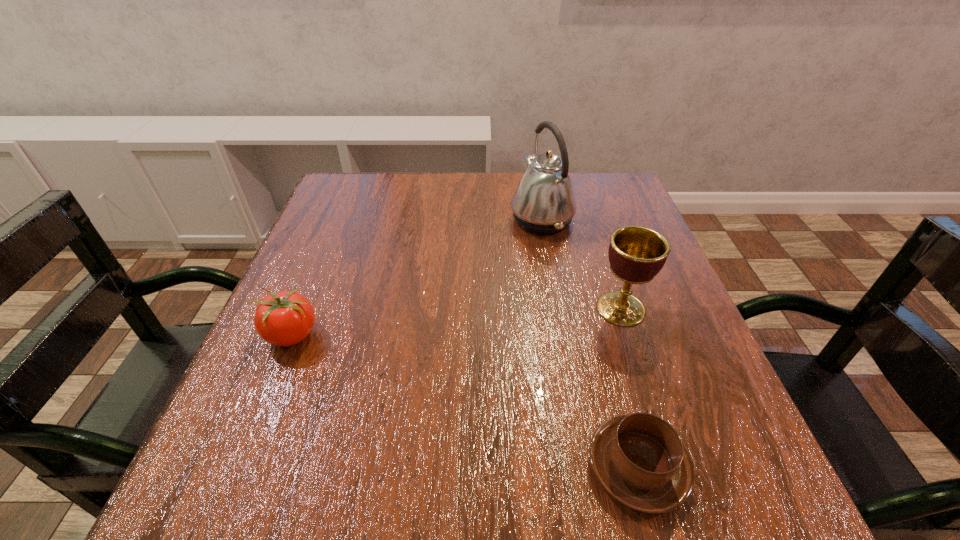
Locate an element on the screen. The width and height of the screenshot is (960, 540). blank area at the near edge is located at coordinates (370, 489).

The width and height of the screenshot is (960, 540). Find the location of `vacant region at the left edge of the desktop`. vacant region at the left edge of the desktop is located at coordinates (340, 241).

Image resolution: width=960 pixels, height=540 pixels. Find the location of `free space at the far left corner`. free space at the far left corner is located at coordinates (366, 174).

The image size is (960, 540). I want to click on blank space at the near left corner of the desktop, so (300, 478).

This screenshot has height=540, width=960. In the image, there is a desktop. What are the coordinates of `free space at the far right corner` in the screenshot? It's located at (621, 179).

In the image, there is a desktop. Identify the location of blank space at the near right corner. The width and height of the screenshot is (960, 540). (708, 482).

Where is `free spot between the nearest object and the third shortest object`? The image size is (960, 540). free spot between the nearest object and the third shortest object is located at coordinates (629, 388).

Locate an element on the screen. free point between the shortest object and the third tallest object is located at coordinates (465, 401).

I want to click on free area in between the kettle and the second shortest object, so click(x=417, y=277).

Locate an element on the screen. vacant area between the farthest object and the shortest object is located at coordinates (589, 343).